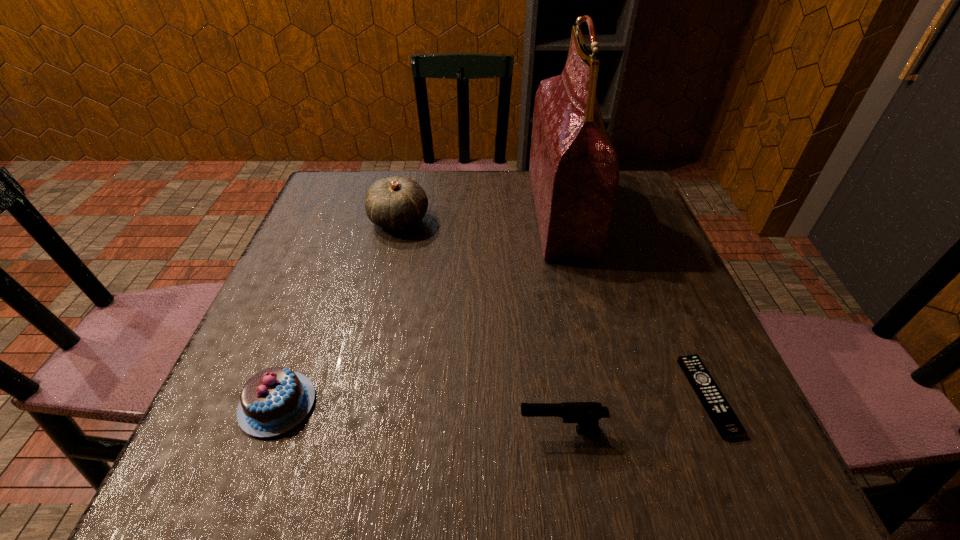
The width and height of the screenshot is (960, 540). In order to click on vacant region at the far left corner in this screenshot , I will do `click(337, 205)`.

The height and width of the screenshot is (540, 960). I want to click on vacant area at the far right corner of the desktop, so click(622, 198).

At what (x,y) coordinates should I click in order to perform the action: click on free location at the near right corner of the desktop. Please return your answer as a coordinate pair (x, y). The height and width of the screenshot is (540, 960). Looking at the image, I should click on coord(706,475).

Identify the location of vacant space that's between the pistol and the fourth shortest object. (480, 326).

Identify the location of free spot between the pistol and the rightmost object. (635, 413).

Find the location of a particular element. The height and width of the screenshot is (540, 960). free spot between the second tallest object and the pistol is located at coordinates (480, 326).

The height and width of the screenshot is (540, 960). Identify the location of empty space between the rightmost object and the second tallest object. (554, 308).

I want to click on free space between the pistol and the handbag, so click(561, 321).

Find the location of a particular element. The height and width of the screenshot is (540, 960). vacant area that lies between the tallest object and the chocolate cake is located at coordinates (419, 308).

The height and width of the screenshot is (540, 960). In order to click on vacant space that is in between the chocolate cake and the pistol in this screenshot , I will do `click(420, 417)`.